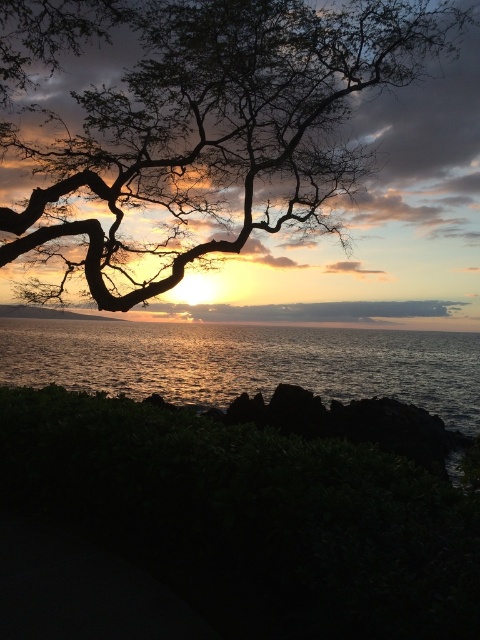
Question: Does dark brown bark tree at upper center have a lesser width compared to glistening silver water at center?

Choices:
 (A) yes
 (B) no

Answer: (A)

Question: Which point is farther to the camera?

Choices:
 (A) (241, 384)
 (B) (327, 112)

Answer: (A)

Question: Is dark brown bark tree at upper center thinner than glistening silver water at center?

Choices:
 (A) no
 (B) yes

Answer: (B)

Question: Where is dark brown bark tree at upper center located in relation to glistening silver water at center in the image?

Choices:
 (A) above
 (B) below

Answer: (A)

Question: Which object appears farthest from the camera in this image?

Choices:
 (A) dark brown bark tree at upper center
 (B) glistening silver water at center

Answer: (B)